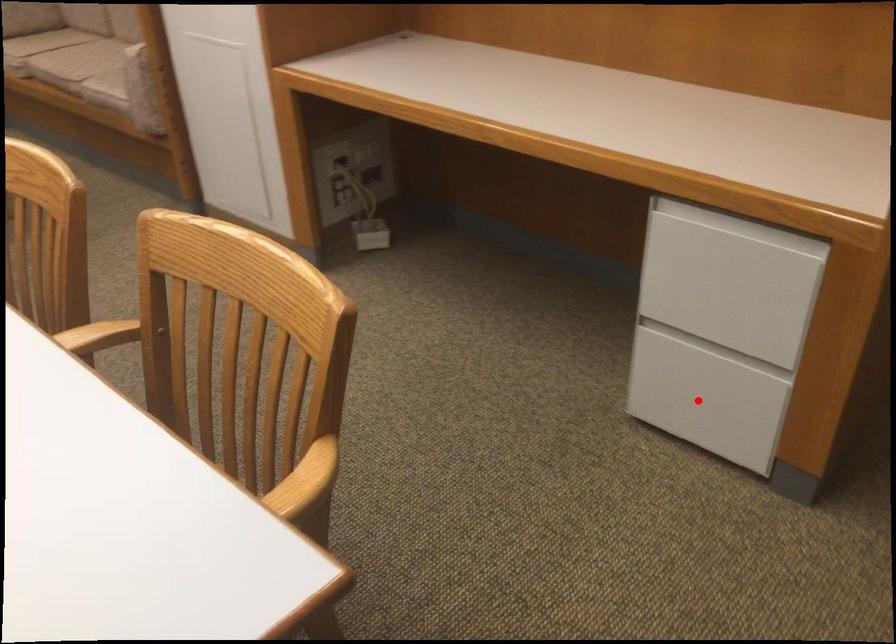
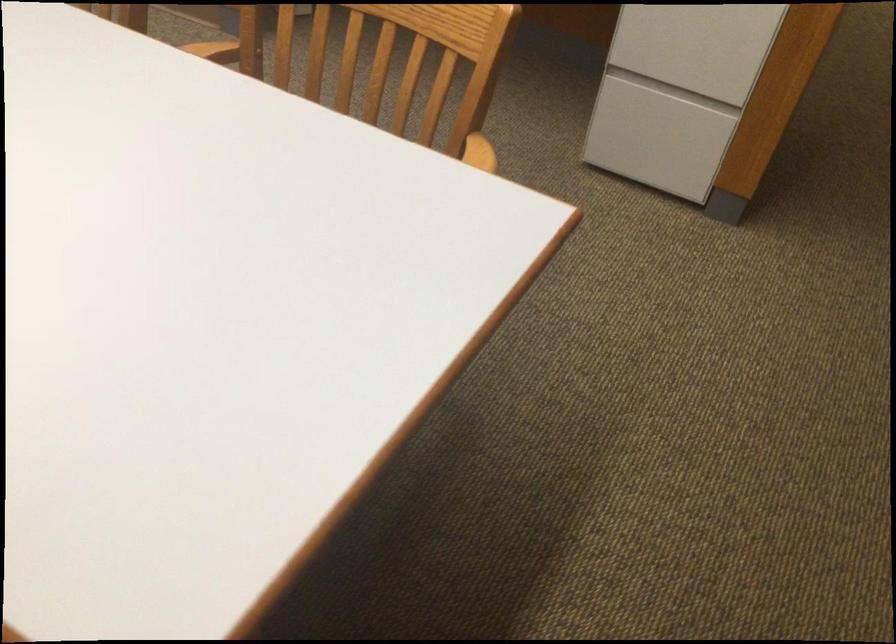
Question: I am providing you with two images of the same scene from different viewpoints. A red point is shown in image1. For the corresponding object point in image2, is it positioned nearer or farther from the camera?

Choices:
 (A) Nearer
 (B) Farther

Answer: (B)